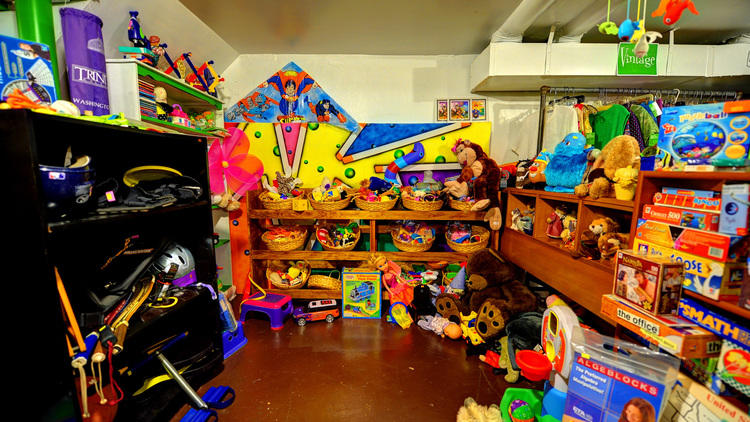
At what (x,y) coordinates should I click in order to perform the action: click on red flooring. Please return your answer as a coordinate pair (x, y). This screenshot has height=422, width=750. Looking at the image, I should click on (352, 364).